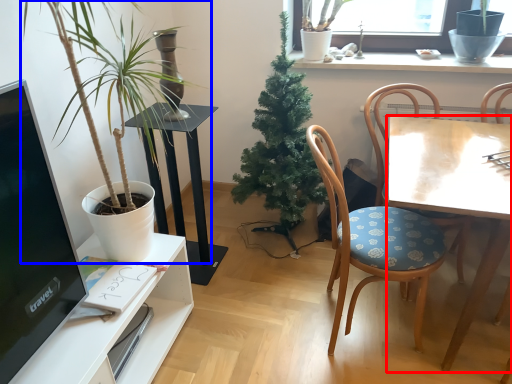
Question: Which point is closer to the camera, desk (highlighted by a red box) or houseplant (highlighted by a blue box)?

Choices:
 (A) desk
 (B) houseplant

Answer: (B)